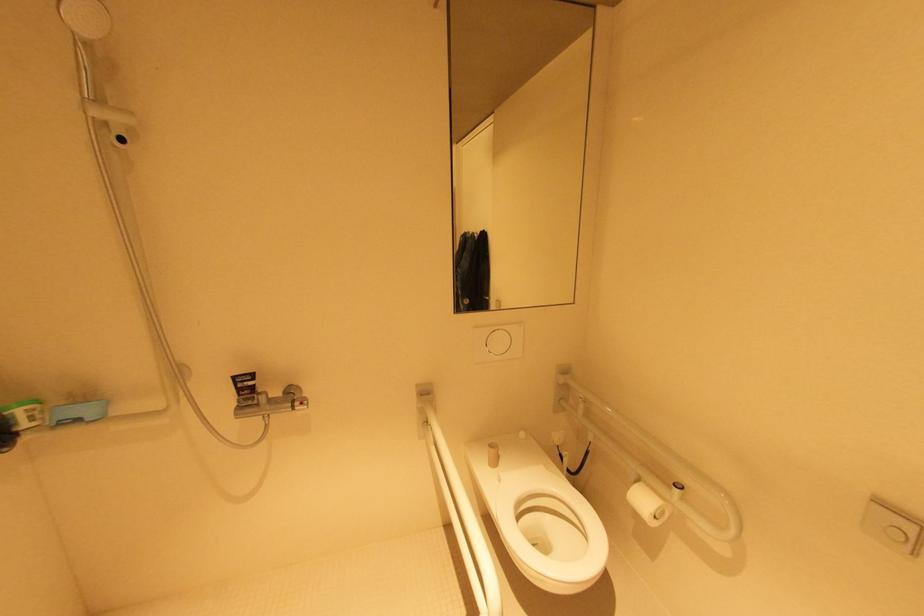
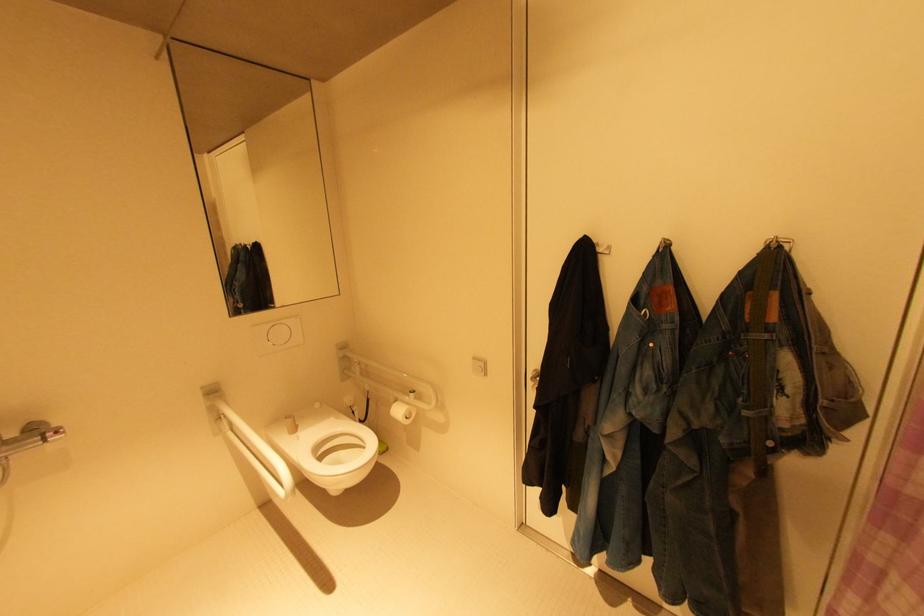
Question: The images are taken continuously from a first-person perspective. In which direction is your viewpoint rotating?

Choices:
 (A) Left
 (B) Right
 (C) Up
 (D) Down

Answer: (B)